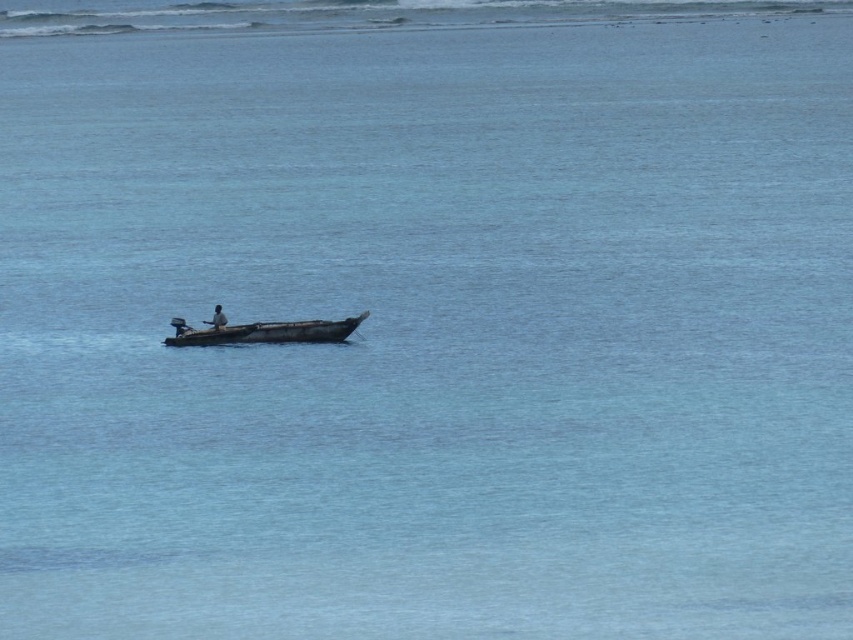
Is point (256, 336) farther from camera compared to point (221, 310)?

No, (256, 336) is closer to viewer.

Describe the element at coordinates (270, 332) in the screenshot. This screenshot has height=640, width=853. I see `wooden boat at center` at that location.

At what (x,y) coordinates should I click in order to perform the action: click on wooden boat at center. Please return your answer as a coordinate pair (x, y). The image size is (853, 640). Looking at the image, I should click on (270, 332).